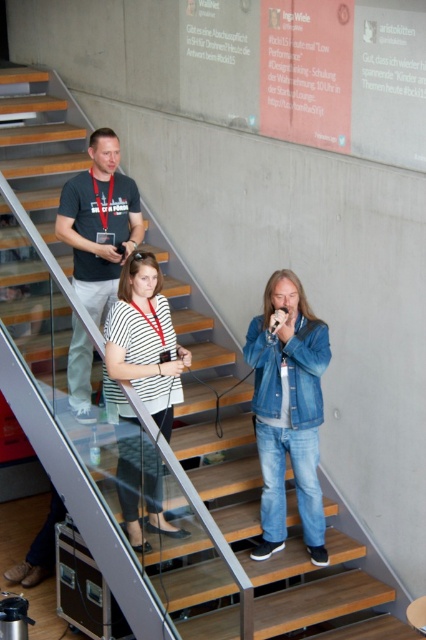
Question: From the image, what is the correct spatial relationship of white striped shirt at center in relation to matte black t-shirt at upper left?

Choices:
 (A) left
 (B) right

Answer: (B)

Question: Which of the following is the closest to the observer?

Choices:
 (A) matte black t-shirt at upper left
 (B) striped cotton shirt at center

Answer: (B)

Question: Which point is farther to the camera?

Choices:
 (A) matte black t-shirt at upper left
 (B) white striped shirt at center

Answer: (A)

Question: Which object appears farthest from the camera in this image?

Choices:
 (A) striped cotton shirt at center
 (B) matte black t-shirt at upper left

Answer: (B)

Question: Is striped cotton shirt at center wider than white striped shirt at center?

Choices:
 (A) no
 (B) yes

Answer: (B)

Question: Where is striped cotton shirt at center located in relation to matte black t-shirt at upper left in the image?

Choices:
 (A) left
 (B) right

Answer: (B)